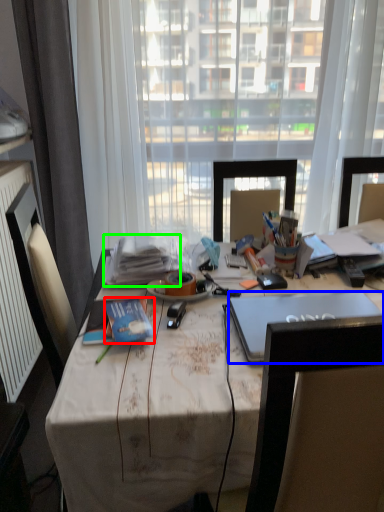
Question: Based on their relative distances, which object is nearer to book (highlighted by a red box)? Choose from laptop (highlighted by a blue box) and book (highlighted by a green box).

Choices:
 (A) laptop
 (B) book

Answer: (B)